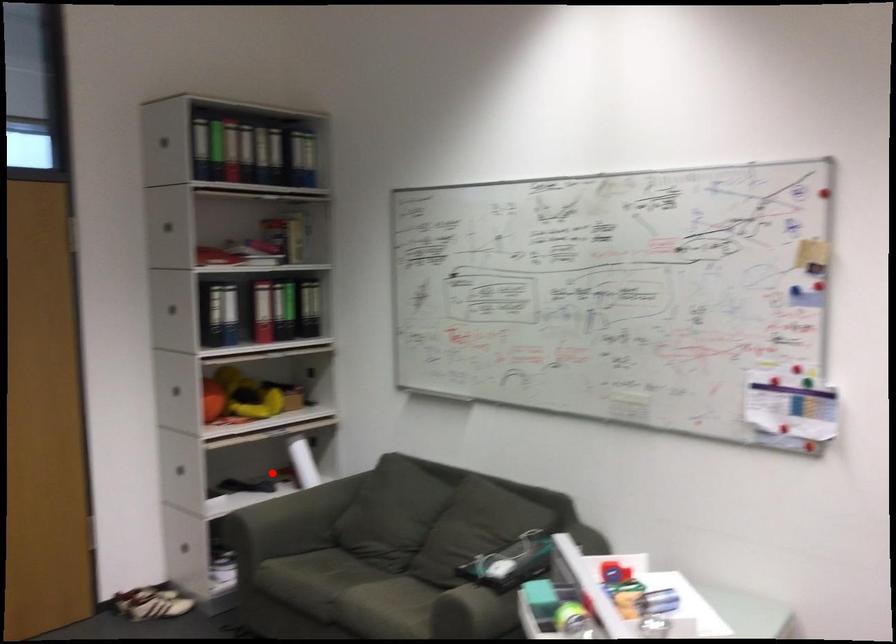
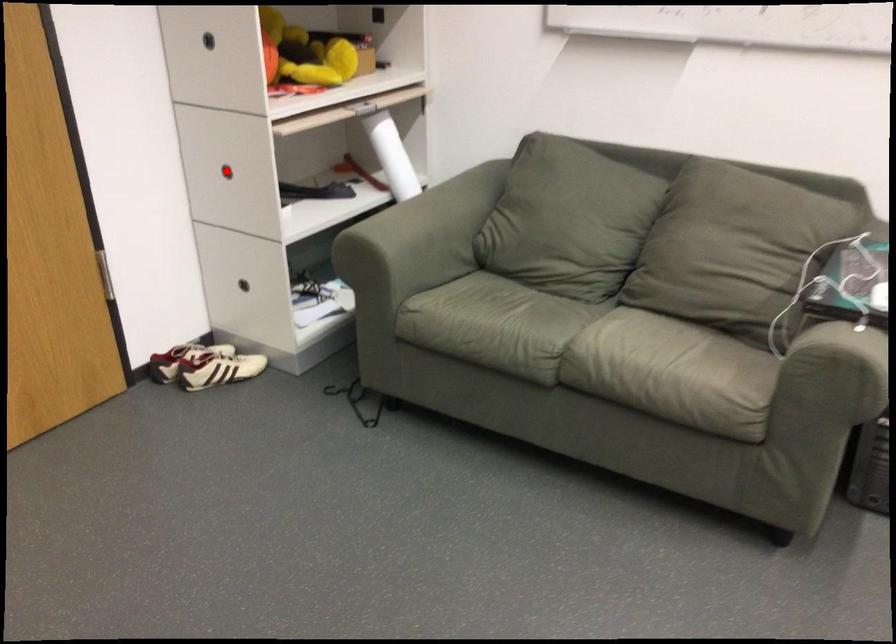
I am providing you with two images of the same scene from different viewpoints. A red point is marked on the first image and another point is marked on the second image. Is the marked point in image1 the same physical position as the marked point in image2?

No